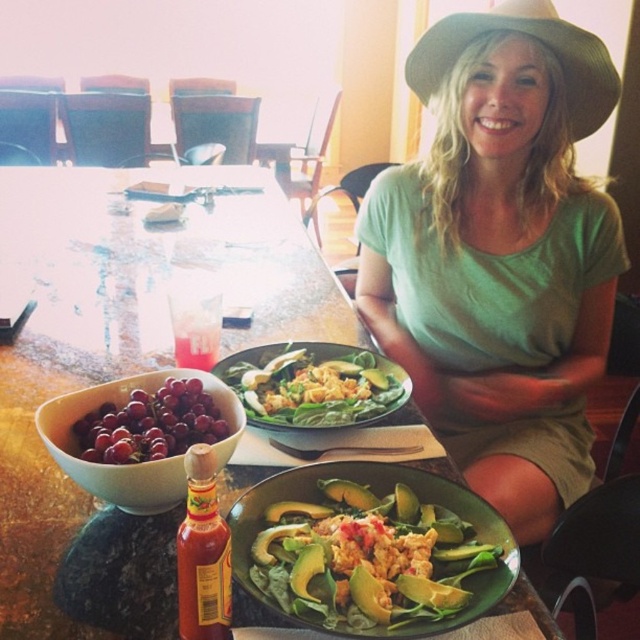
Question: Which of the following is the closest to the observer?

Choices:
 (A) (372, 314)
 (B) (371, 461)

Answer: (B)

Question: Can you confirm if green cotton shirt at center is positioned below translucent glass hot sauce at center?

Choices:
 (A) yes
 (B) no

Answer: (B)

Question: Is green cotton shirt at center smaller than translucent glass hot sauce at center?

Choices:
 (A) yes
 (B) no

Answer: (B)

Question: Can you confirm if shiny red grapes at lower left is positioned below translucent glass hot sauce at center?

Choices:
 (A) no
 (B) yes

Answer: (A)

Question: Which point appears closest to the camera in this image?

Choices:
 (A) (68, 211)
 (B) (211, 509)
 (C) (273, 422)
 (D) (586, 449)

Answer: (B)

Question: Which point is closer to the camera?

Choices:
 (A) (193, 380)
 (B) (481, 195)
 (C) (500, 600)
 (D) (189, 589)

Answer: (D)